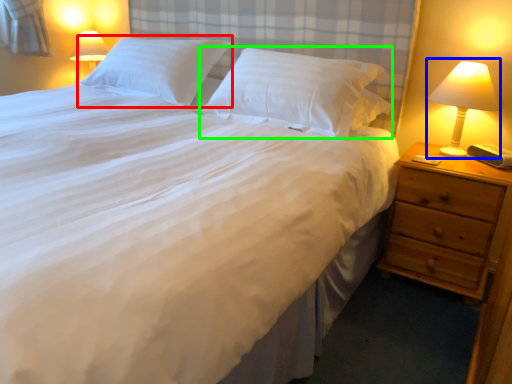
Question: Which object is the farthest from pillow (highlighted by a red box)? Choose among these: bedside lamp (highlighted by a blue box) or pillow (highlighted by a green box).

Choices:
 (A) bedside lamp
 (B) pillow

Answer: (A)